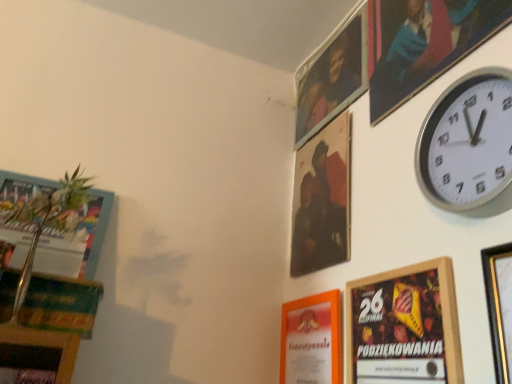
Question: From a real-world perspective, is metallic silver picture frame at upper right, the sixth picture frame in the front-to-back sequence, located beneath silver metallic wall clock at upper right?

Choices:
 (A) yes
 (B) no

Answer: (B)

Question: From a real-world perspective, is metallic silver picture frame at upper right, which is the first picture frame from back to front, over silver metallic wall clock at upper right?

Choices:
 (A) yes
 (B) no

Answer: (A)

Question: Does metallic silver picture frame at upper right, which is the first picture frame from back to front, have a greater width compared to silver metallic wall clock at upper right?

Choices:
 (A) no
 (B) yes

Answer: (A)

Question: From the image's perspective, does metallic silver picture frame at upper right, which is the first picture frame from back to front, appear higher than silver metallic wall clock at upper right?

Choices:
 (A) yes
 (B) no

Answer: (A)

Question: Does metallic silver picture frame at upper right, the sixth picture frame in the front-to-back sequence, have a larger size compared to silver metallic wall clock at upper right?

Choices:
 (A) yes
 (B) no

Answer: (A)

Question: Would you say metallic silver picture frame at upper right, which is the first picture frame from back to front, is outside silver metallic wall clock at upper right?

Choices:
 (A) no
 (B) yes

Answer: (B)

Question: Can you confirm if wooden framed poster at lower right, which appears as the 5th picture frame when viewed from the back, is positioned to the right of wooden picture frame at upper right, which appears as the 3th picture frame when viewed from the front?

Choices:
 (A) yes
 (B) no

Answer: (B)

Question: Is wooden picture frame at upper right, which appears as the 3th picture frame when viewed from the front, located within wooden framed poster at lower right, which appears as the 5th picture frame when viewed from the back?

Choices:
 (A) no
 (B) yes

Answer: (A)

Question: Is wooden framed poster at lower right, which appears as the 5th picture frame when viewed from the back, aimed at wooden picture frame at upper right, the fourth picture frame positioned from the back?

Choices:
 (A) yes
 (B) no

Answer: (B)

Question: Is wooden framed poster at lower right, which appears as the 5th picture frame when viewed from the back, thinner than wooden picture frame at upper right, the fourth picture frame positioned from the back?

Choices:
 (A) no
 (B) yes

Answer: (B)

Question: Can you confirm if wooden framed poster at lower right, which appears as the 5th picture frame when viewed from the back, is positioned to the left of wooden picture frame at upper right, the fourth picture frame positioned from the back?

Choices:
 (A) yes
 (B) no

Answer: (A)

Question: Is wooden framed poster at lower right, placed as the 2th picture frame when sorted from front to back, not within wooden picture frame at upper right, the fourth picture frame positioned from the back?

Choices:
 (A) no
 (B) yes

Answer: (B)

Question: Considering the relative sizes of gold metallic picture frame at upper right, which is the 6th picture frame from back to front, and metallic silver picture frame at upper right, which is the first picture frame from back to front, in the image provided, is gold metallic picture frame at upper right, which is the 6th picture frame from back to front, taller than metallic silver picture frame at upper right, which is the first picture frame from back to front,?

Choices:
 (A) yes
 (B) no

Answer: (A)